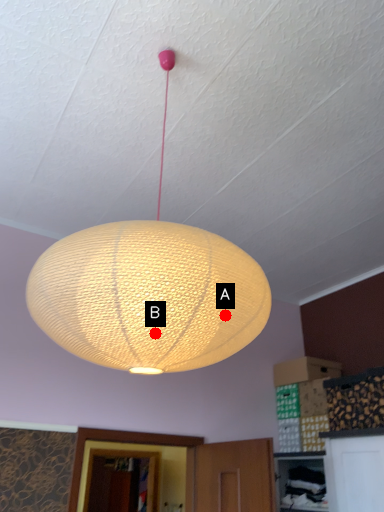
Question: Two points are circled on the image, labeled by A and B beside each circle. Which point is closer to the camera?

Choices:
 (A) A is closer
 (B) B is closer

Answer: (B)